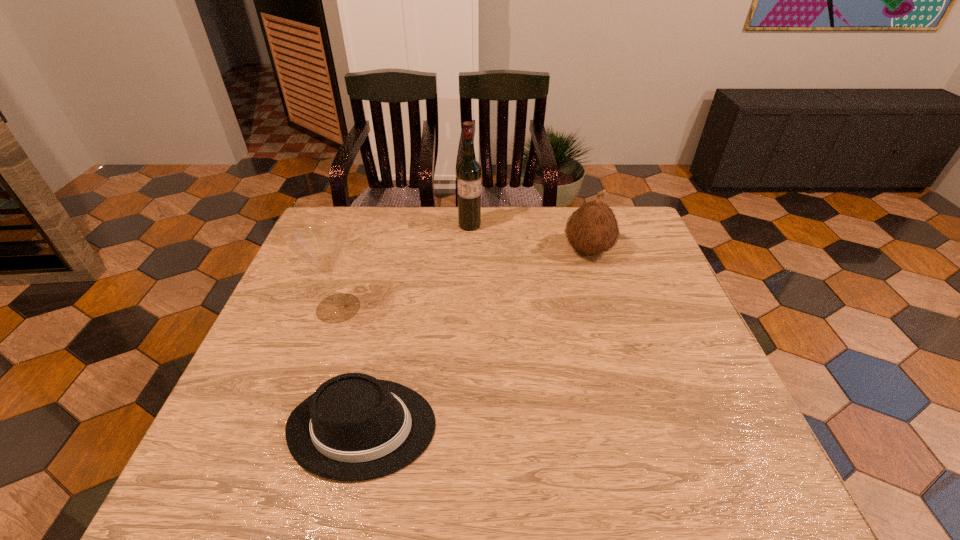
The width and height of the screenshot is (960, 540). I want to click on free point located on the surface of the third nearest object, so click(450, 250).

Where is `vacant area located on the back of the third farthest object`? vacant area located on the back of the third farthest object is located at coordinates (348, 279).

At what (x,y) coordinates should I click in order to perform the action: click on blank space located 0.230m on the front-facing side of the fedora. Please return your answer as a coordinate pair (x, y). This screenshot has height=540, width=960. Looking at the image, I should click on (549, 427).

Identify the location of wine bottle at the far edge. (468, 171).

Locate an element on the screen. coconut present at the far edge is located at coordinates (x=592, y=229).

Locate an element on the screen. This screenshot has width=960, height=540. object that is at the near edge is located at coordinates (354, 427).

Identify the location of flute glass at the left edge. The height and width of the screenshot is (540, 960). (321, 244).

This screenshot has height=540, width=960. Find the location of `fedora present at the left edge`. fedora present at the left edge is located at coordinates (354, 427).

What are the coordinates of `object that is at the right edge` in the screenshot? It's located at (592, 229).

You are a GUI agent. You are given a task and a screenshot of the screen. Output one action in this format:
    pyautogui.click(x=<x>, y=<y>)
    Task: Click on the object at the near left corner
    
    Given the screenshot: What is the action you would take?
    pyautogui.click(x=354, y=427)